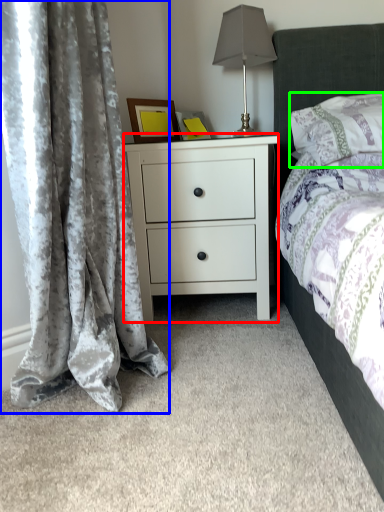
Question: Estimate the real-world distances between objects in this image. Which object is farther from nightstand (highlighted by a red box), curtain (highlighted by a blue box) or pillow (highlighted by a green box)?

Choices:
 (A) curtain
 (B) pillow

Answer: (A)